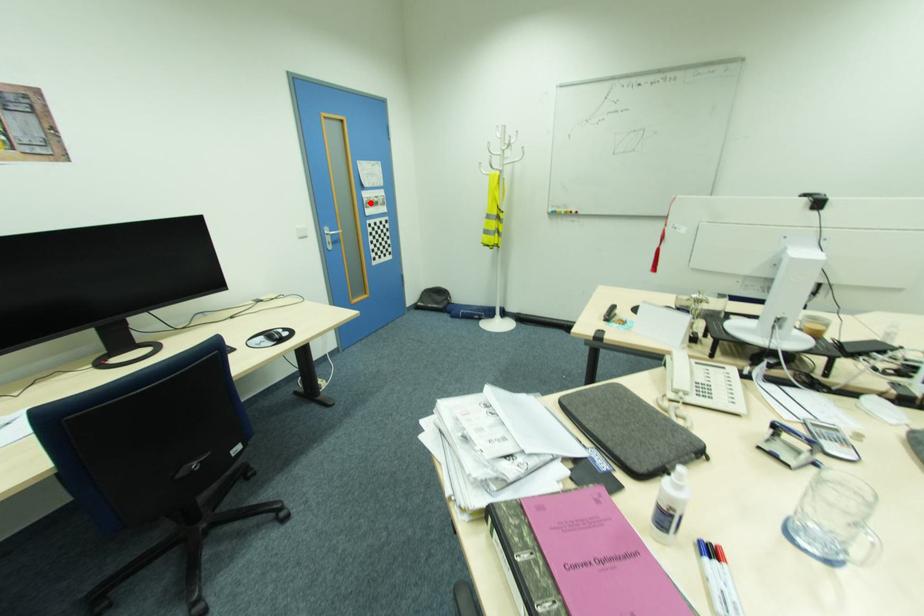
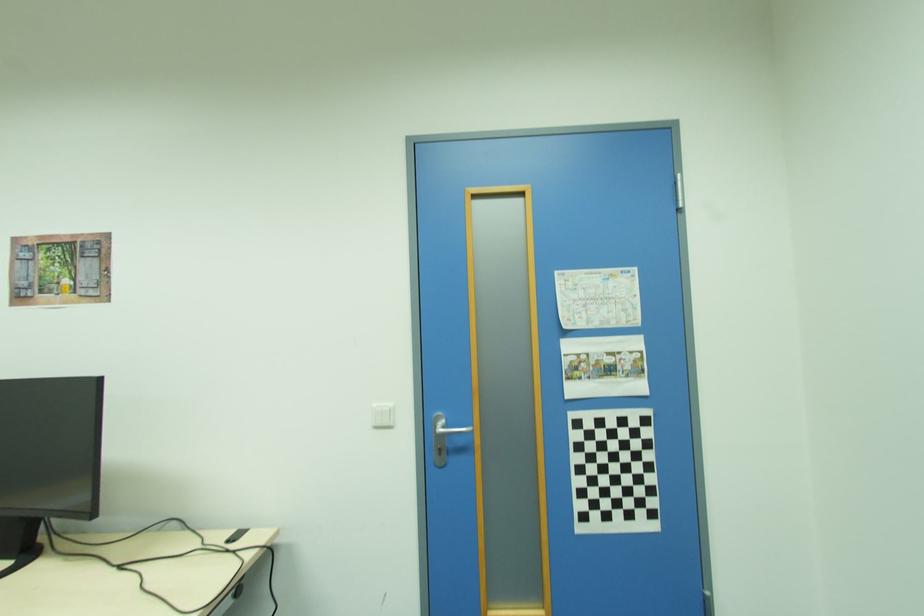
Where in the second image is the point corresponding to the highlighted location from the first image?

(579, 369)